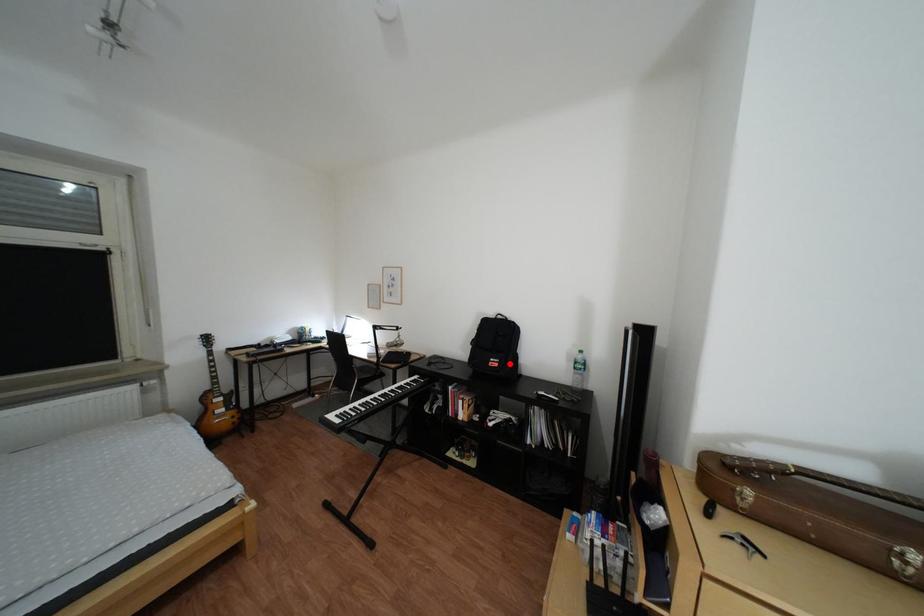
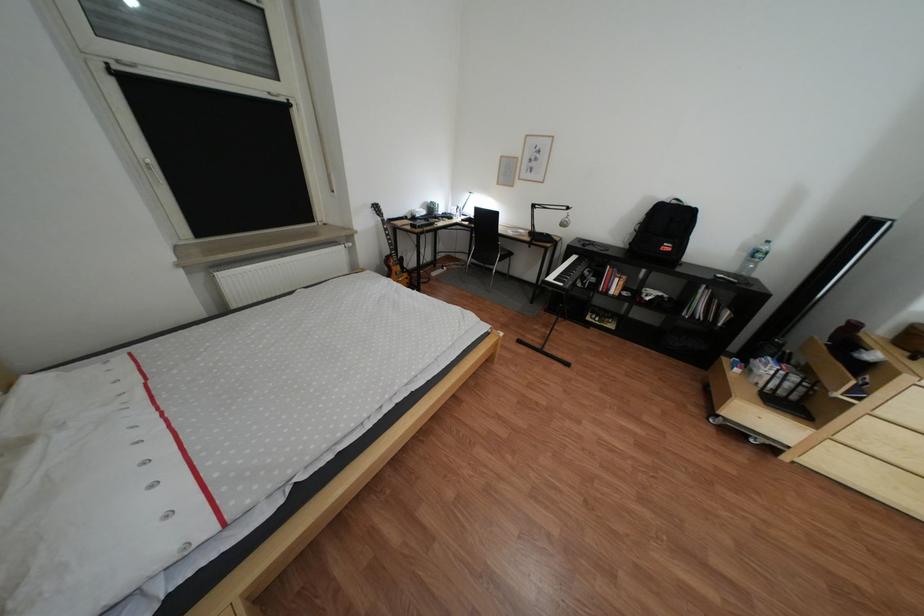
Find the pixel in the second image that matches the highlighted location in the first image.

(683, 248)